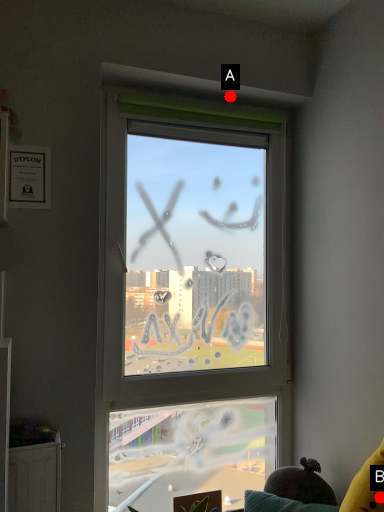
Question: Two points are circled on the image, labeled by A and B beside each circle. Which point is farther to the camera?

Choices:
 (A) A is further
 (B) B is further

Answer: (A)